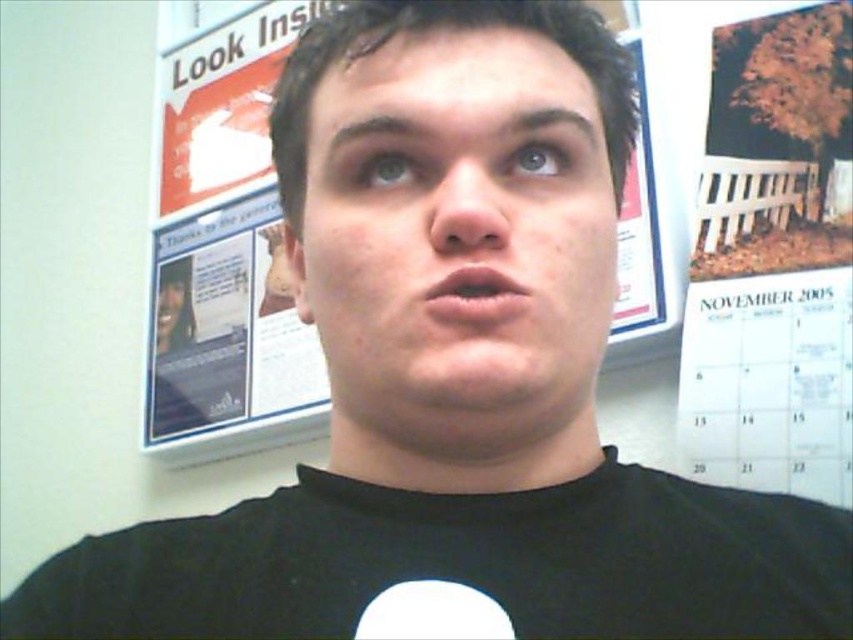
Question: Does black matte t-shirt at center have a larger size compared to smooth skin face at center?

Choices:
 (A) yes
 (B) no

Answer: (A)

Question: Among these points, which one is farthest from the camera?

Choices:
 (A) (442, 154)
 (B) (625, 512)

Answer: (B)

Question: Which of the following is the closest to the observer?

Choices:
 (A) smooth skin face at center
 (B) black matte t-shirt at center

Answer: (B)

Question: Is black matte t-shirt at center wider than smooth skin face at center?

Choices:
 (A) no
 (B) yes

Answer: (B)

Question: Which object appears closest to the camera in this image?

Choices:
 (A) black matte t-shirt at center
 (B) smooth skin face at center

Answer: (A)

Question: Can you confirm if black matte t-shirt at center is smaller than smooth skin face at center?

Choices:
 (A) no
 (B) yes

Answer: (A)